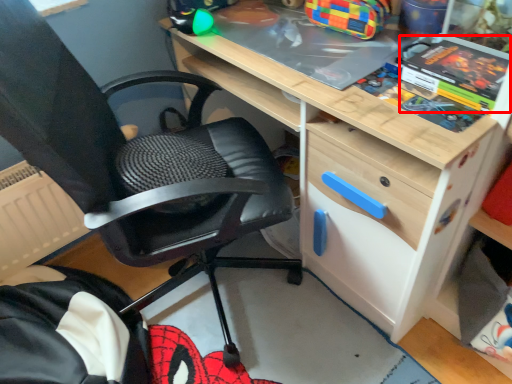
Question: From the image, what is the correct spatial relationship of comic book (annotated by the red box) in relation to chair?

Choices:
 (A) right
 (B) left

Answer: (A)